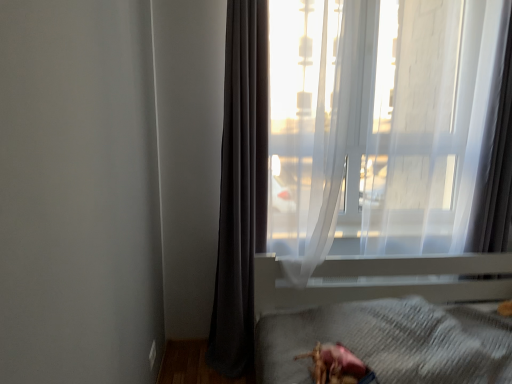
Question: Does point (490, 286) appear closer or farther from the camera than point (274, 8)?

Choices:
 (A) farther
 (B) closer

Answer: (A)

Question: Considering the positions of white plastic bed frame at lower right and transparent fabric at upper right in the image, is white plastic bed frame at lower right bigger or smaller than transparent fabric at upper right?

Choices:
 (A) small
 (B) big

Answer: (B)

Question: Estimate the real-world distances between objects in this image. Which object is farther from the dark gray fabric curtain at left?

Choices:
 (A) white plastic bed frame at lower right
 (B) shiny pink toy at lower center
 (C) transparent fabric at upper right

Answer: (B)

Question: Estimate the real-world distances between objects in this image. Which object is farther from the dark gray fabric curtain at left?

Choices:
 (A) shiny pink toy at lower center
 (B) transparent fabric at upper right
 (C) white plastic bed frame at lower right

Answer: (A)